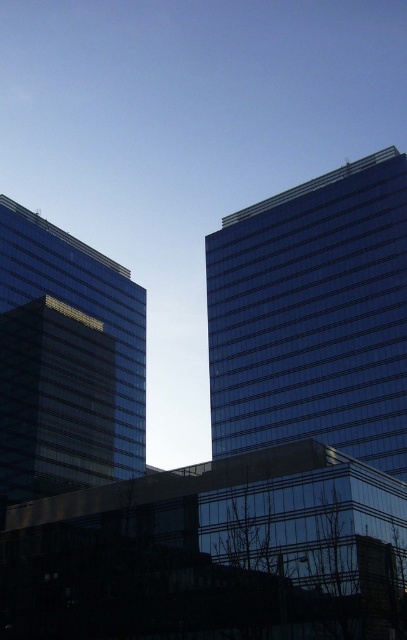
Does shiny glass building at right have a lesser height compared to transparent glass building at left?

Yes.

Between shiny glass building at right and transparent glass building at left, which one is positioned lower?

transparent glass building at left is lower down.

Is point (306, 371) farther from camera compared to point (10, 497)?

Yes.

Find the location of a particular element. This screenshot has width=407, height=640. shiny glass building at right is located at coordinates (313, 316).